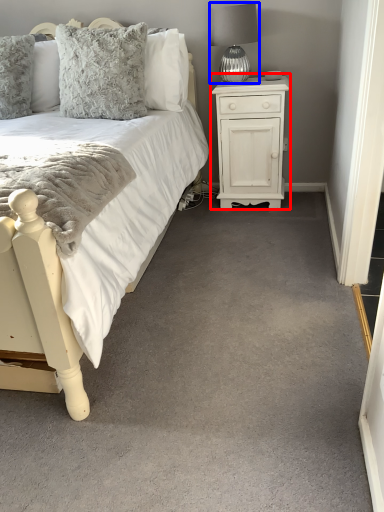
Question: Among these objects, which one is nearest to the camera, nightstand (highlighted by a red box) or table lamp (highlighted by a blue box)?

Choices:
 (A) nightstand
 (B) table lamp

Answer: (B)